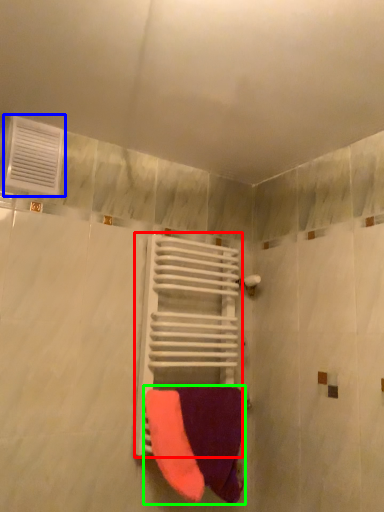
Question: Which object is positioned closest to balustrade (highlighted by a red box)? Select from air conditioning (highlighted by a blue box) and towel (highlighted by a green box).

Choices:
 (A) air conditioning
 (B) towel

Answer: (B)